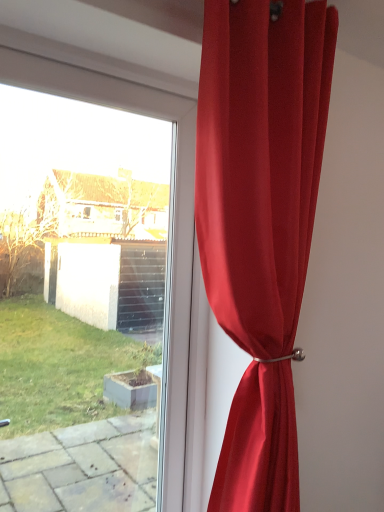
What do you see at coordinates (172, 250) in the screenshot? The width and height of the screenshot is (384, 512). I see `transparent glass window at upper left` at bounding box center [172, 250].

You are a GUI agent. You are given a task and a screenshot of the screen. Output one action in this format:
    pyautogui.click(x=<x>, y=<y>)
    Task: Click on the transparent glass window at upper left
    This screenshot has width=384, height=512.
    Given the screenshot: What is the action you would take?
    pyautogui.click(x=172, y=250)

This screenshot has height=512, width=384. I want to click on satin red curtain at right, so click(260, 220).

This screenshot has width=384, height=512. Describe the element at coordinates (260, 220) in the screenshot. I see `satin red curtain at right` at that location.

At what (x,y) coordinates should I click in order to perform the action: click on transparent glass window at upper left. Please return your answer as a coordinate pair (x, y). The height and width of the screenshot is (512, 384). Looking at the image, I should click on (172, 250).

Considering the relative positions of transparent glass window at upper left and satin red curtain at right in the image provided, is transparent glass window at upper left to the right of satin red curtain at right from the viewer's perspective?

No.

Considering the relative positions of transparent glass window at upper left and satin red curtain at right in the image provided, is transparent glass window at upper left behind satin red curtain at right?

Yes, it is.

Which is nearer, (190, 229) or (214, 290)?

Clearly, point (190, 229) is more distant from the camera than point (214, 290).

From the image's perspective, which one is positioned lower, transparent glass window at upper left or satin red curtain at right?

transparent glass window at upper left, from the image's perspective.

From a real-world perspective, which object stands above the other?

satin red curtain at right is physically above.

Can you confirm if transparent glass window at upper left is wider than satin red curtain at right?

Incorrect, the width of transparent glass window at upper left does not surpass that of satin red curtain at right.

Does transparent glass window at upper left have a lesser height compared to satin red curtain at right?

Yes.

Which of these two, transparent glass window at upper left or satin red curtain at right, is bigger?

Bigger between the two is satin red curtain at right.

Can satin red curtain at right be found inside transparent glass window at upper left?

No, satin red curtain at right is not inside transparent glass window at upper left.

Is transparent glass window at upper left touching satin red curtain at right?

transparent glass window at upper left and satin red curtain at right are clearly separated.

Is transparent glass window at upper left oriented towards satin red curtain at right?

Yes.

How far apart are transparent glass window at upper left and satin red curtain at right?

transparent glass window at upper left and satin red curtain at right are 15.84 inches apart.

The width and height of the screenshot is (384, 512). Identify the location of curtain that appears in front of the transparent glass window at upper left. (260, 220).

Is satin red curtain at right to the right of transparent glass window at upper left from the viewer's perspective?

Yes.

Is satin red curtain at right behind transparent glass window at upper left?

No, it is in front of transparent glass window at upper left.

Between point (222, 265) and point (42, 85), which one is positioned behind?

Positioned behind is point (42, 85).

From the image's perspective, is satin red curtain at right located above or below transparent glass window at upper left?

Based on their image positions, satin red curtain at right is located above transparent glass window at upper left.

From a real-world perspective, who is located higher, satin red curtain at right or transparent glass window at upper left?

satin red curtain at right, from a real-world perspective.

Can you confirm if satin red curtain at right is thinner than transparent glass window at upper left?

No.

Which of these two, satin red curtain at right or transparent glass window at upper left, stands taller?

satin red curtain at right.

Is satin red curtain at right bigger or smaller than transparent glass window at upper left?

Clearly, satin red curtain at right is larger in size than transparent glass window at upper left.

Could transparent glass window at upper left be considered to be inside satin red curtain at right?

No, transparent glass window at upper left is not a part of satin red curtain at right.

Are satin red curtain at right and transparent glass window at upper left located far from each other?

No.

Is satin red curtain at right looking in the opposite direction of transparent glass window at upper left?

Absolutely, satin red curtain at right is directed away from transparent glass window at upper left.

The height and width of the screenshot is (512, 384). In order to click on window located below the satin red curtain at right (from the image's perspective) in this screenshot , I will do pyautogui.click(x=172, y=250).

Identify the location of window that appears below the satin red curtain at right (from the image's perspective). (172, 250).

At what (x,y) coordinates should I click in order to perform the action: click on window located behind the satin red curtain at right. Please return your answer as a coordinate pair (x, y). Image resolution: width=384 pixels, height=512 pixels. Looking at the image, I should click on (172, 250).